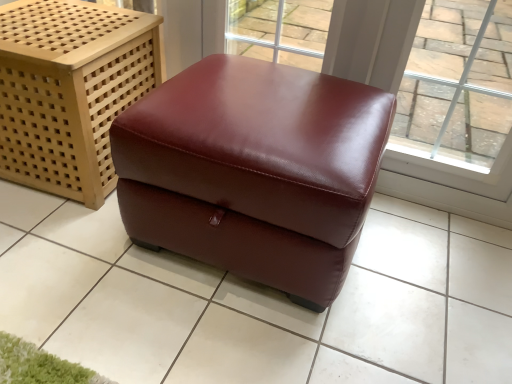
How much space does burgundy leather ottoman at center, positioned as the second furniture in right-to-left order, occupy vertically?

It is 19.93 inches.

The image size is (512, 384). What do you see at coordinates (70, 91) in the screenshot?
I see `burgundy leather ottoman at center, marked as the first furniture in a left-to-right arrangement` at bounding box center [70, 91].

This screenshot has width=512, height=384. Describe the element at coordinates (254, 171) in the screenshot. I see `burgundy leather ottoman at center, the 2th furniture from the left` at that location.

Locate an element on the screen. The image size is (512, 384). burgundy leather ottoman at center is located at coordinates (258, 302).

Image resolution: width=512 pixels, height=384 pixels. Find the location of `burgundy leather ottoman at center, marked as the first furniture in a left-to-right arrangement`. burgundy leather ottoman at center, marked as the first furniture in a left-to-right arrangement is located at coordinates (70, 91).

Is transparent glass window at upper right aimed at burgundy leather ottoman at center?

No, transparent glass window at upper right does not turn towards burgundy leather ottoman at center.

From a real-world perspective, between transparent glass window at upper right and burgundy leather ottoman at center, who is vertically lower?

burgundy leather ottoman at center.

Where is `window that appears above the burgundy leather ottoman at center (from the image's perspective)`? The height and width of the screenshot is (384, 512). window that appears above the burgundy leather ottoman at center (from the image's perspective) is located at coordinates (457, 85).

Which is more to the right, transparent glass window at upper right or burgundy leather ottoman at center?

transparent glass window at upper right.

Is burgundy leather ottoman at center, marked as the first furniture in a left-to-right arrangement, smaller than burgundy leather ottoman at center?

Actually, burgundy leather ottoman at center, marked as the first furniture in a left-to-right arrangement, might be larger than burgundy leather ottoman at center.

From a real-world perspective, between burgundy leather ottoman at center, positioned as the second furniture in right-to-left order, and burgundy leather ottoman at center, who is vertically higher?

burgundy leather ottoman at center, positioned as the second furniture in right-to-left order, from a real-world perspective.

How different are the orientations of burgundy leather ottoman at center, marked as the first furniture in a left-to-right arrangement, and burgundy leather ottoman at center in degrees?

The facing directions of burgundy leather ottoman at center, marked as the first furniture in a left-to-right arrangement, and burgundy leather ottoman at center are 93 degrees apart.

How far apart are burgundy leather ottoman at center, positioned as the second furniture in right-to-left order, and burgundy leather ottoman at center?

burgundy leather ottoman at center, positioned as the second furniture in right-to-left order, and burgundy leather ottoman at center are 45.05 centimeters apart from each other.

Can you confirm if burgundy leather ottoman at center, marked as the first furniture in a left-to-right arrangement, is taller than transparent glass window at upper right?

No.

Could you tell me if burgundy leather ottoman at center, positioned as the second furniture in right-to-left order, is facing transparent glass window at upper right?

No, burgundy leather ottoman at center, positioned as the second furniture in right-to-left order, does not turn towards transparent glass window at upper right.

Is burgundy leather ottoman at center, positioned as the second furniture in right-to-left order, located outside transparent glass window at upper right?

Indeed, burgundy leather ottoman at center, positioned as the second furniture in right-to-left order, is completely outside transparent glass window at upper right.

Is the position of transparent glass window at upper right more distant than that of burgundy leather ottoman at center, positioned as the second furniture in right-to-left order?

No, transparent glass window at upper right is closer to the camera.

Between transparent glass window at upper right and burgundy leather ottoman at center, marked as the first furniture in a left-to-right arrangement, which one has smaller size?

Smaller between the two is transparent glass window at upper right.

From the picture: Considering the relative sizes of transparent glass window at upper right and burgundy leather ottoman at center, positioned as the second furniture in right-to-left order, in the image provided, is transparent glass window at upper right shorter than burgundy leather ottoman at center, positioned as the second furniture in right-to-left order,?

In fact, transparent glass window at upper right may be taller than burgundy leather ottoman at center, positioned as the second furniture in right-to-left order.

There is a transparent glass window at upper right. Where is `the 2nd furniture below it (from a real-world perspective)`? Image resolution: width=512 pixels, height=384 pixels. the 2nd furniture below it (from a real-world perspective) is located at coordinates pos(70,91).

Does point (7, 273) lie behind point (478, 155)?

No, (7, 273) is in front of (478, 155).

Which of these two, burgundy leather ottoman at center or transparent glass window at upper right, is smaller?

With smaller size is transparent glass window at upper right.

Does burgundy leather ottoman at center have a lesser height compared to transparent glass window at upper right?

Yes, burgundy leather ottoman at center is shorter than transparent glass window at upper right.

Is burgundy leather ottoman at center far from transparent glass window at upper right?

Absolutely, burgundy leather ottoman at center is distant from transparent glass window at upper right.

Considering their positions, is burgundy leather ottoman at center, the 1th furniture from the right, located in front of or behind transparent glass window at upper right?

burgundy leather ottoman at center, the 1th furniture from the right, is positioned closer to the viewer than transparent glass window at upper right.

I want to click on the 1st furniture counting from the left of the transparent glass window at upper right, so click(254, 171).

Is point (193, 238) more distant than point (492, 133)?

No, it is in front of (492, 133).

Does burgundy leather ottoman at center, the 2th furniture from the left, touch transparent glass window at upper right?

burgundy leather ottoman at center, the 2th furniture from the left, and transparent glass window at upper right are not in contact.

Considering the sizes of transparent glass window at upper right and burgundy leather ottoman at center, the 1th furniture from the right, in the image, is transparent glass window at upper right taller or shorter than burgundy leather ottoman at center, the 1th furniture from the right,?

transparent glass window at upper right is taller than burgundy leather ottoman at center, the 1th furniture from the right.

Would you say transparent glass window at upper right is to the left or to the right of burgundy leather ottoman at center, the 1th furniture from the right, in the picture?

From the image, it's evident that transparent glass window at upper right is to the right of burgundy leather ottoman at center, the 1th furniture from the right.

Is transparent glass window at upper right inside or outside of burgundy leather ottoman at center, the 2th furniture from the left?

transparent glass window at upper right is spatially situated outside burgundy leather ottoman at center, the 2th furniture from the left.

Which is closer, (x=503, y=123) or (x=317, y=89)?

Point (x=503, y=123) appears to be farther away from the viewer than point (x=317, y=89).

At what (x,y) coordinates should I click in order to perform the action: click on tile in front of the transparent glass window at upper right. Please return your answer as a coordinate pair (x, y). Image resolution: width=512 pixels, height=384 pixels. Looking at the image, I should click on (258, 302).

Image resolution: width=512 pixels, height=384 pixels. In order to click on tile below the burgundy leather ottoman at center, marked as the first furniture in a left-to-right arrangement (from a real-world perspective) in this screenshot , I will do `click(258, 302)`.

Based on their spatial positions, is burgundy leather ottoman at center, marked as the first furniture in a left-to-right arrangement, or burgundy leather ottoman at center, the 2th furniture from the left, further from transparent glass window at upper right?

burgundy leather ottoman at center, marked as the first furniture in a left-to-right arrangement, lies further to transparent glass window at upper right than the other object.

Considering their positions, is burgundy leather ottoman at center positioned closer to burgundy leather ottoman at center, marked as the first furniture in a left-to-right arrangement, than burgundy leather ottoman at center, the 2th furniture from the left?

burgundy leather ottoman at center, the 2th furniture from the left.

Estimate the real-world distances between objects in this image. Which object is closer to burgundy leather ottoman at center, marked as the first furniture in a left-to-right arrangement, burgundy leather ottoman at center or transparent glass window at upper right?

burgundy leather ottoman at center is closer to burgundy leather ottoman at center, marked as the first furniture in a left-to-right arrangement.

Looking at the image, which one is located further to transparent glass window at upper right, burgundy leather ottoman at center, positioned as the second furniture in right-to-left order, or burgundy leather ottoman at center?

Among the two, burgundy leather ottoman at center is located further to transparent glass window at upper right.

Based on their spatial positions, is burgundy leather ottoman at center, positioned as the second furniture in right-to-left order, or burgundy leather ottoman at center, the 1th furniture from the right, further from burgundy leather ottoman at center?

burgundy leather ottoman at center, positioned as the second furniture in right-to-left order, is positioned further to the anchor burgundy leather ottoman at center.

Estimate the real-world distances between objects in this image. Which object is further from burgundy leather ottoman at center, the 1th furniture from the right, transparent glass window at upper right or burgundy leather ottoman at center?

Among the two, transparent glass window at upper right is located further to burgundy leather ottoman at center, the 1th furniture from the right.

Estimate the real-world distances between objects in this image. Which object is closer to transparent glass window at upper right, burgundy leather ottoman at center, the 1th furniture from the right, or burgundy leather ottoman at center, positioned as the second furniture in right-to-left order?

burgundy leather ottoman at center, the 1th furniture from the right.

Looking at the image, which one is located closer to transparent glass window at upper right, burgundy leather ottoman at center or burgundy leather ottoman at center, the 1th furniture from the right?

Based on the image, burgundy leather ottoman at center, the 1th furniture from the right, appears to be nearer to transparent glass window at upper right.

Image resolution: width=512 pixels, height=384 pixels. What are the coordinates of `furniture between burgundy leather ottoman at center, marked as the first furniture in a left-to-right arrangement, and transparent glass window at upper right, in the horizontal direction` in the screenshot? It's located at (254, 171).

The image size is (512, 384). I want to click on tile situated between burgundy leather ottoman at center, positioned as the second furniture in right-to-left order, and transparent glass window at upper right from left to right, so click(258, 302).

This screenshot has width=512, height=384. Find the location of `tile located between burgundy leather ottoman at center, positioned as the second furniture in right-to-left order, and burgundy leather ottoman at center, the 2th furniture from the left, in the left-right direction`. tile located between burgundy leather ottoman at center, positioned as the second furniture in right-to-left order, and burgundy leather ottoman at center, the 2th furniture from the left, in the left-right direction is located at coordinates (258, 302).

The height and width of the screenshot is (384, 512). I want to click on furniture between burgundy leather ottoman at center and transparent glass window at upper right in the horizontal direction, so click(x=254, y=171).